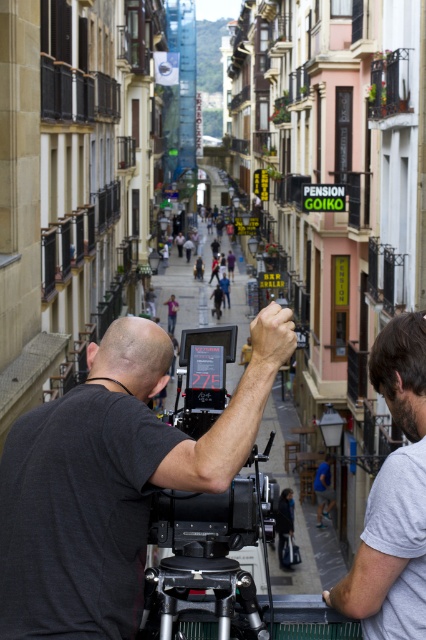
Is black matte camera at center smaller than silver metallic tripod at center?

Yes.

Does black matte camera at center appear on the left side of silver metallic tripod at center?

Correct, you'll find black matte camera at center to the left of silver metallic tripod at center.

The image size is (426, 640). In order to click on black matte camera at center in this screenshot , I will do `click(112, 480)`.

Based on the photo, does black matte camera at center have a larger size compared to gray cotton shirt at right?

No, black matte camera at center is not bigger than gray cotton shirt at right.

Does black matte camera at center have a greater height compared to gray cotton shirt at right?

No, black matte camera at center is not taller than gray cotton shirt at right.

Is point (25, 513) farther from camera compared to point (411, 484)?

No, it is in front of (411, 484).

The image size is (426, 640). I want to click on black matte camera at center, so click(112, 480).

Does gray cotton shirt at right appear over silver metallic tripod at center?

Indeed, gray cotton shirt at right is positioned over silver metallic tripod at center.

Consider the image. Does gray cotton shirt at right have a lesser height compared to silver metallic tripod at center?

No.

Which is behind, point (374, 563) or point (169, 568)?

Point (169, 568)

Find the location of a particular element. gray cotton shirt at right is located at coordinates (394, 499).